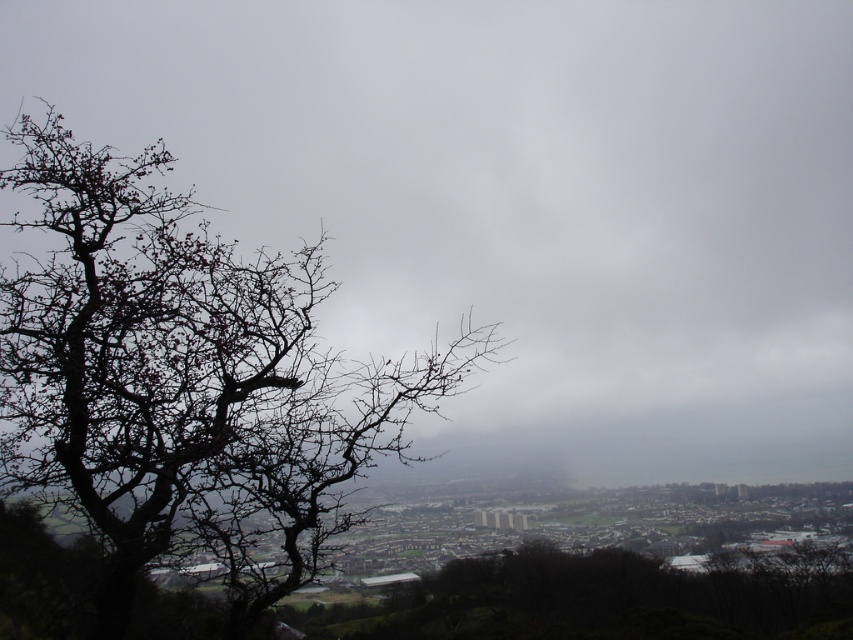
Question: Can you confirm if gray cloudy sky at upper center is positioned above bare branches at left?

Choices:
 (A) no
 (B) yes

Answer: (B)

Question: Does gray cloudy sky at upper center have a greater width compared to bare branches at left?

Choices:
 (A) no
 (B) yes

Answer: (B)

Question: Observing the image, what is the correct spatial positioning of gray cloudy sky at upper center in reference to bare branches at left?

Choices:
 (A) above
 (B) below

Answer: (A)